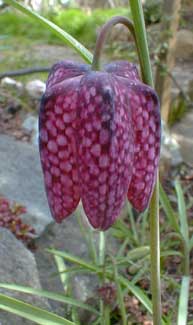
You are a GUI agent. You are given a task and a screenshot of the screen. Output one action in this format:
    pyautogui.click(x=<x>, y=<y>)
    Task: Click on the wood post
    This screenshot has width=193, height=325.
    Given the screenshot: What is the action you would take?
    pyautogui.click(x=174, y=13)